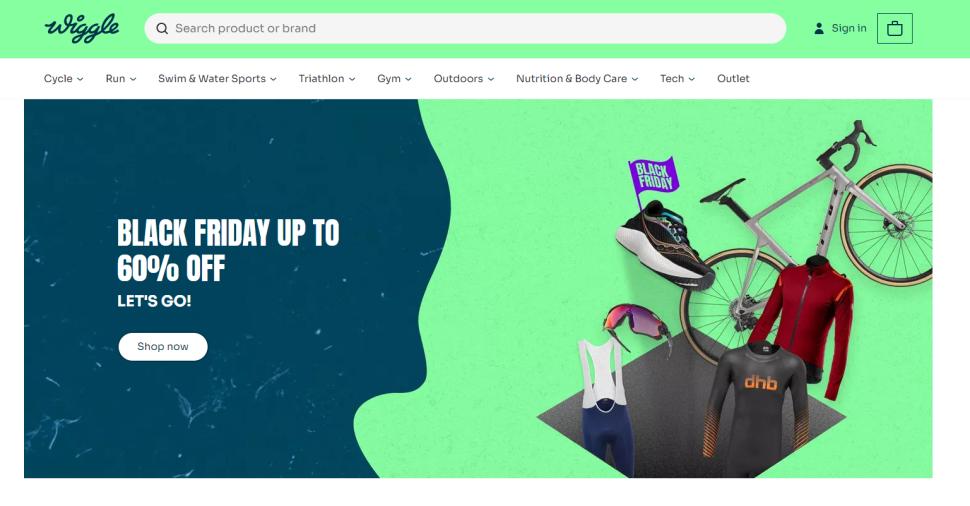
Where is `outlet button`? The height and width of the screenshot is (506, 970). outlet button is located at coordinates (737, 77).